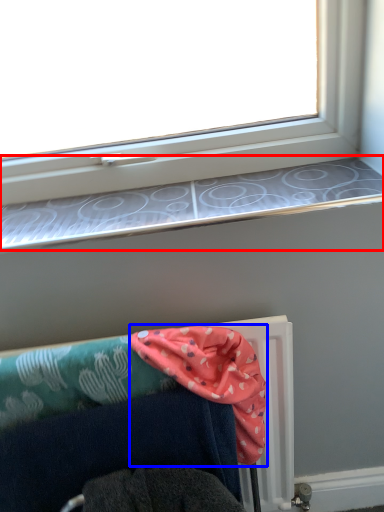
Question: Among these objects, which one is farthest to the camera, window sill (highlighted by a red box) or scarf (highlighted by a blue box)?

Choices:
 (A) window sill
 (B) scarf

Answer: (A)